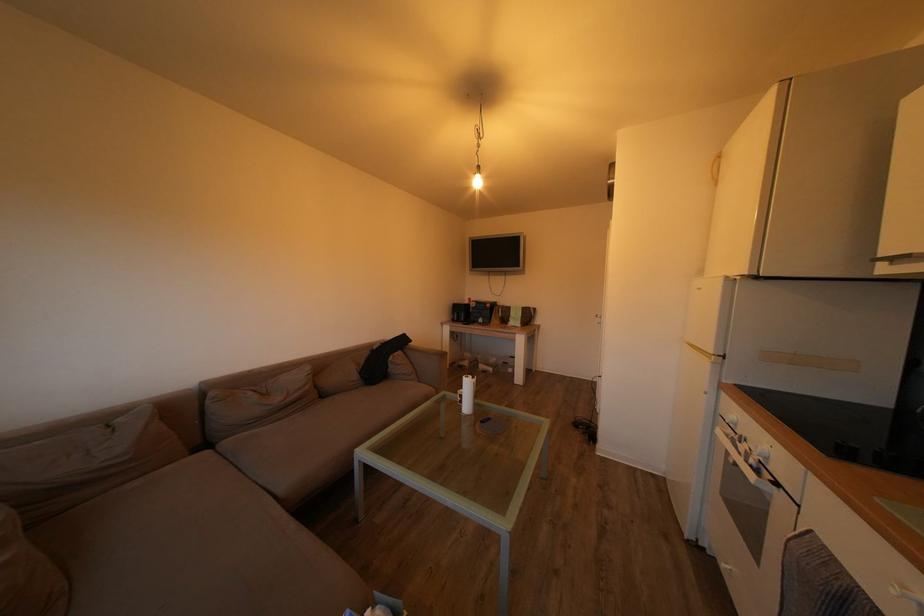
Find where to turn the hanging light bulb. Please return your answer as a coordinate pair (x, y).

(477, 179)